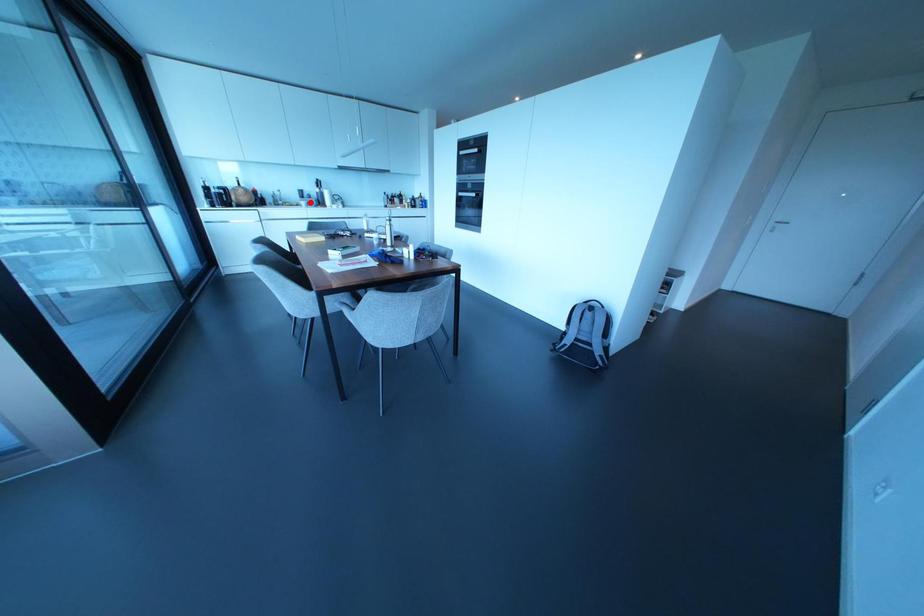
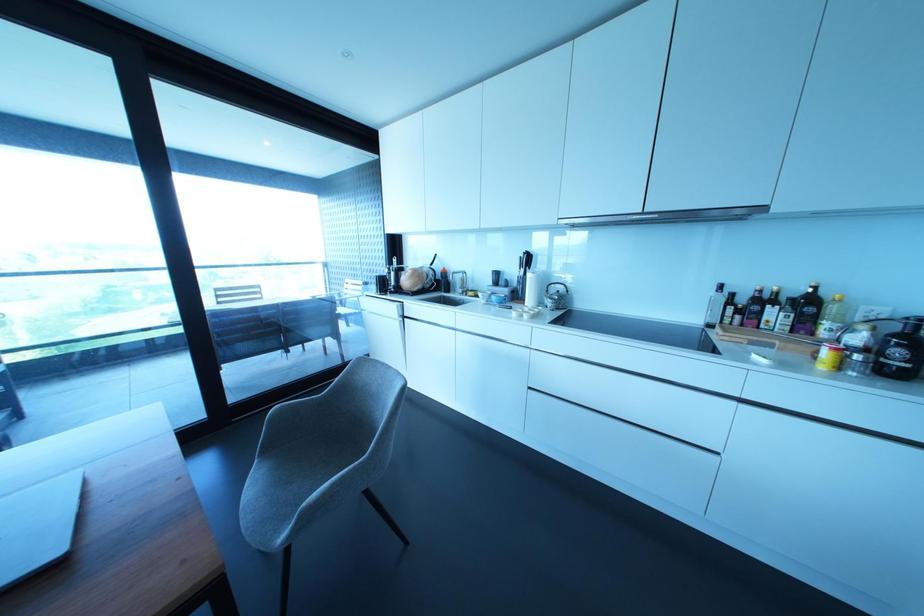
The point at the highlighted location is marked in the first image. Where is the corresponding point in the second image?

(492, 297)